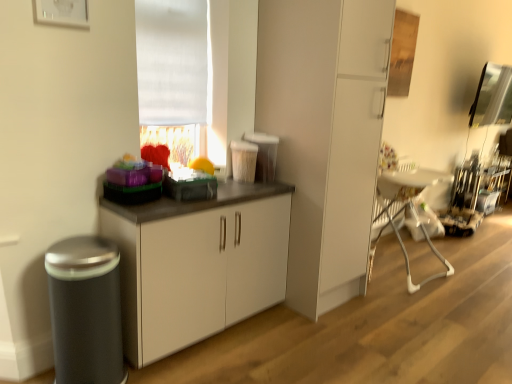
Find the location of a particular element. This screenshot has height=384, width=512. unoccupied area in front of white plastic swivel chair at right is located at coordinates (414, 296).